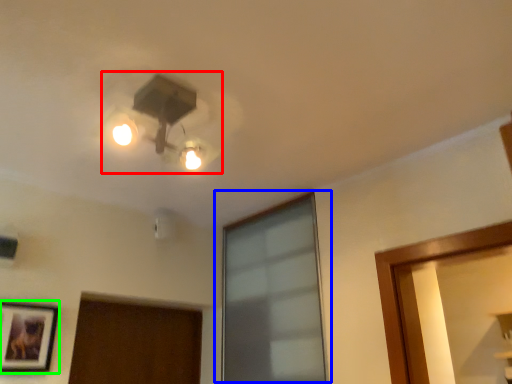
Question: Which object is positioned farthest from lamp (highlighted by a red box)? Select from window (highlighted by a blue box) and picture frame (highlighted by a green box).

Choices:
 (A) window
 (B) picture frame

Answer: (B)